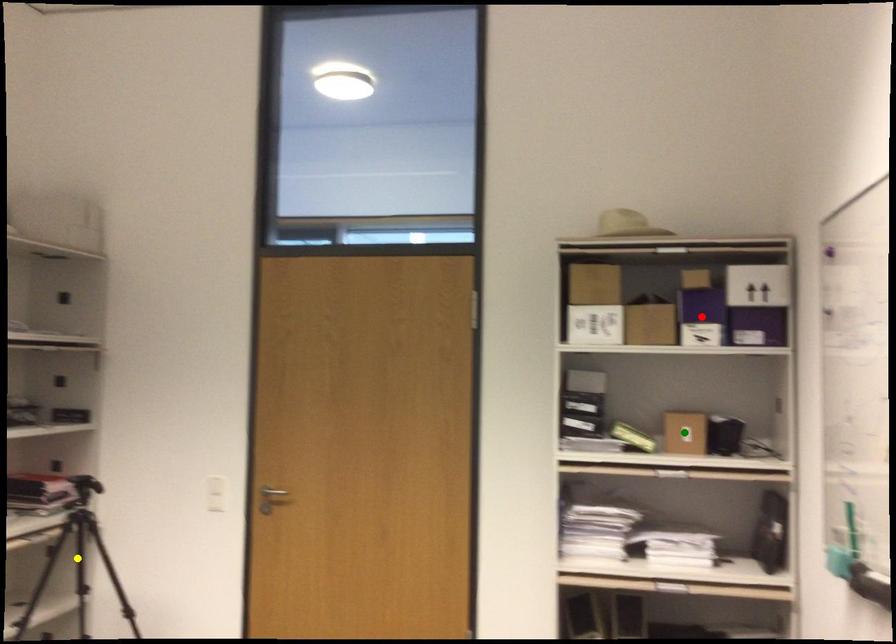
Order these from nearest to farthest:
red point, yellow point, green point

red point < green point < yellow point